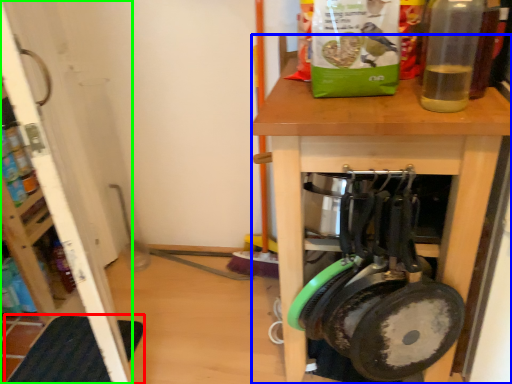
Question: Considering the real-world distances, which object is closest to mat (highlighted by a red box)? desk (highlighted by a blue box) or screen door (highlighted by a green box).

Choices:
 (A) desk
 (B) screen door

Answer: (B)